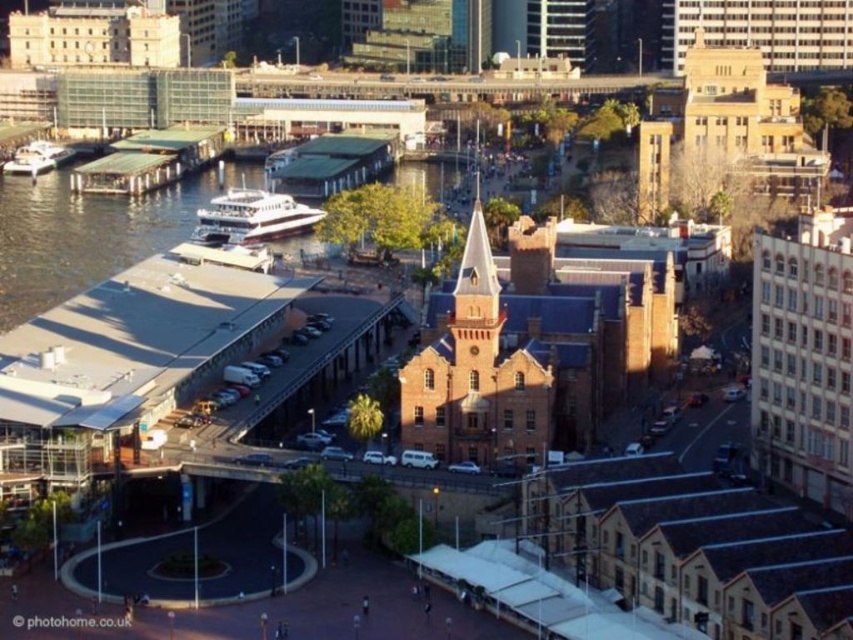
You are standing at the historic red brick building with a pointed tower and want to walk towards the point marked as point (45, 168). Which direction should you walk relative to the point marked as point (258, 214)?

You should walk towards the point (45, 168) by moving behind the point (258, 214) since point (258, 214) is in front of point (45, 168).

You are a tourist standing at the waterfront and see the white glossy ferry at upper left and the white glossy boat at left. Which one is closer to you?

The white glossy ferry at upper left is closer to you because it is in front of the white glossy boat at left.

You are a tourist standing at the waterfront and want to take a photo of the white glossy ferry at upper left and the white glossy boat at left. Which one is closer to the camera?

The white glossy ferry at upper left is positioned under the white glossy boat at left, so the boat at left is closer to the camera.